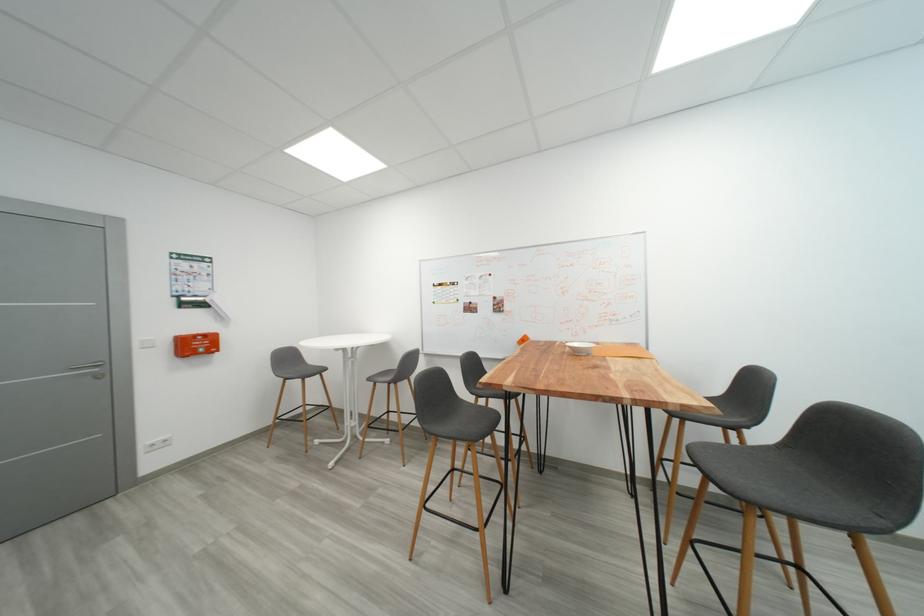
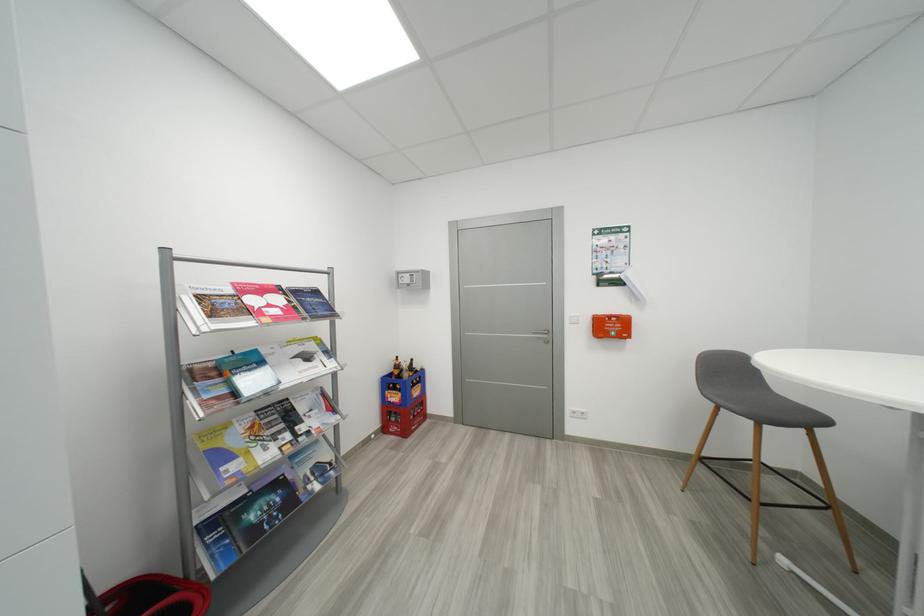
Find the pixel in the second image that matches pixel 104 379 in the first image.

(553, 344)